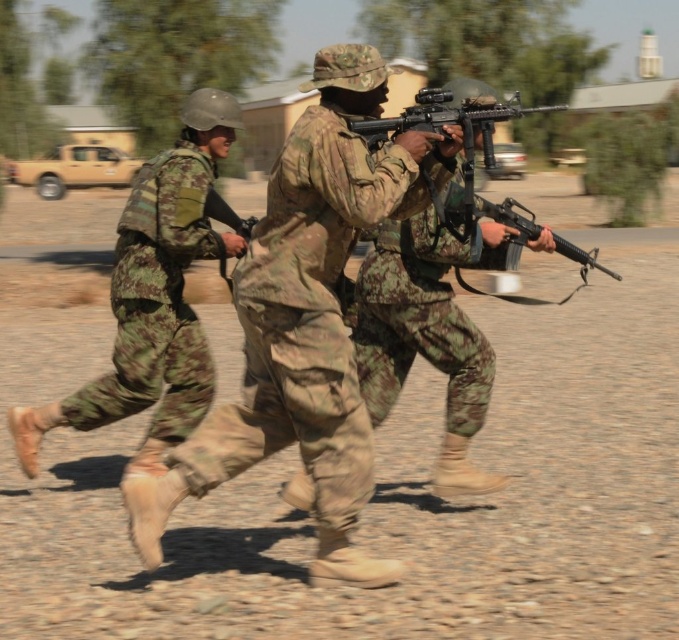
Question: Is camouflage fabric uniform at center behind black matte rifle at center?

Choices:
 (A) no
 (B) yes

Answer: (A)

Question: In this image, where is camouflage fabric uniform at center located relative to camouflage fabric helmet at left?

Choices:
 (A) left
 (B) right

Answer: (B)

Question: Is camouflage fabric uniform at center above camouflage fabric rifle at center?

Choices:
 (A) no
 (B) yes

Answer: (B)

Question: Which object appears closest to the camera in this image?

Choices:
 (A) camouflage fabric rifle at center
 (B) black matte rifle at center

Answer: (B)

Question: Which point is farther to the camera?

Choices:
 (A) black matte rifle at center
 (B) camouflage fabric rifle at center

Answer: (B)

Question: Among these objects, which one is farthest from the camera?

Choices:
 (A) camouflage fabric rifle at center
 (B) camouflage fabric helmet at left
 (C) camouflage fabric uniform at center

Answer: (A)